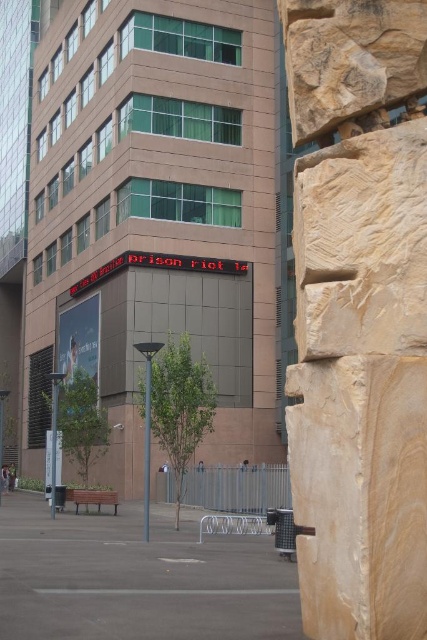
Is brown concrete plaza at center positioned at the back of sandstone textured wall at right?

Yes, it is.

This screenshot has width=427, height=640. Identify the location of brown concrete plaza at center. (157, 212).

Is point (128, 420) positioned after point (327, 138)?

Yes, it is.

Locate an element on the screen. The width and height of the screenshot is (427, 640). brown concrete plaza at center is located at coordinates (157, 212).